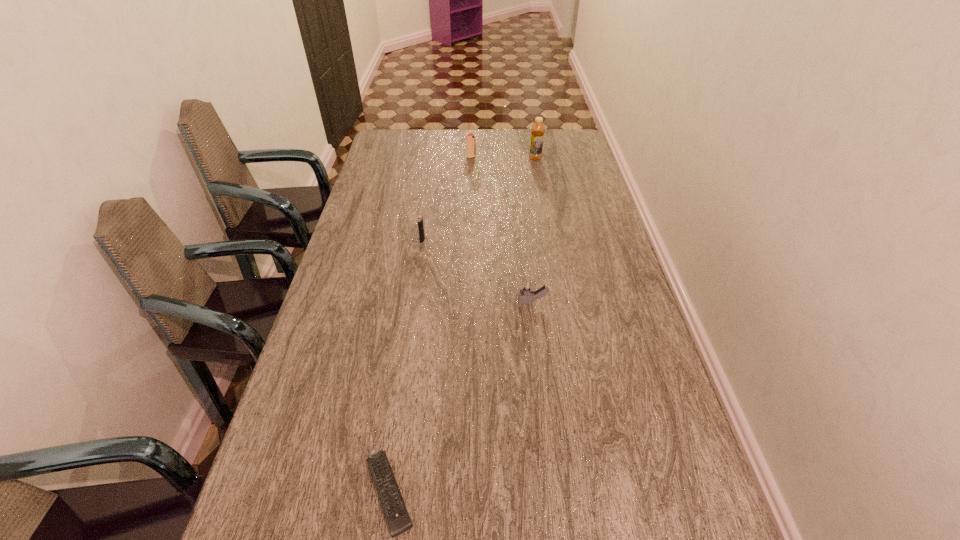
The image size is (960, 540). I want to click on the rightmost object, so click(x=538, y=129).

You are a GUI agent. You are given a task and a screenshot of the screen. Output one action in this format:
    pyautogui.click(x=<x>, y=<y>)
    Task: Click on the tallest object
    
    Given the screenshot: What is the action you would take?
    pyautogui.click(x=538, y=129)

I want to click on the third object from right to left, so click(470, 139).

This screenshot has width=960, height=540. Identify the location of the second igniter from right to left. (470, 139).

Find the location of a particular element. The image size is (960, 540). the third nearest object is located at coordinates (420, 219).

Where is `the second nearest igniter`? the second nearest igniter is located at coordinates (420, 219).

Locate an element on the screen. This screenshot has width=960, height=540. the second shortest object is located at coordinates (526, 289).

The height and width of the screenshot is (540, 960). In order to click on the shortest igniter in this screenshot , I will do `click(526, 289)`.

Find the location of a particular element. The image size is (960, 540). the nearest object is located at coordinates (398, 519).

Where is `remote control`? Image resolution: width=960 pixels, height=540 pixels. remote control is located at coordinates coord(398,519).